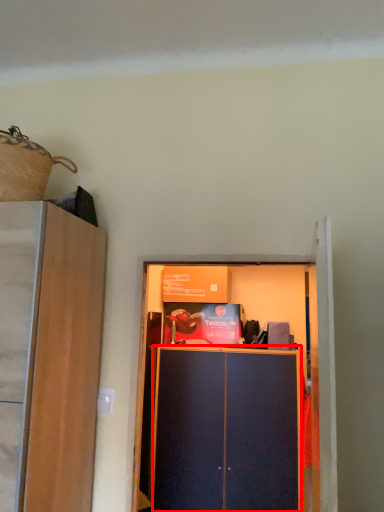
Question: Observing the image, what is the correct spatial positioning of cabinetry (annotated by the red box) in reference to cupboard?

Choices:
 (A) right
 (B) left

Answer: (A)